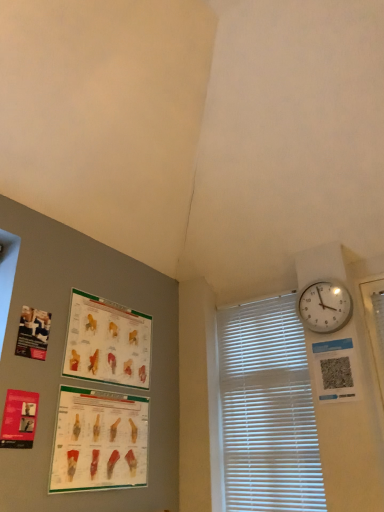
Question: From a real-world perspective, is white plastic blinds at right positioned under matte paper poster at lower left, the first poster page positioned from the bottom, based on gravity?

Choices:
 (A) no
 (B) yes

Answer: (A)

Question: From the image's perspective, would you say white plastic blinds at right is shown under matte paper poster at lower left, marked as the fourth poster page in a top-to-bottom arrangement?

Choices:
 (A) yes
 (B) no

Answer: (B)

Question: Does white plastic blinds at right have a greater height compared to matte paper poster at lower left, marked as the fourth poster page in a top-to-bottom arrangement?

Choices:
 (A) yes
 (B) no

Answer: (A)

Question: Does white plastic blinds at right have a smaller size compared to matte paper poster at lower left, the first poster page positioned from the bottom?

Choices:
 (A) yes
 (B) no

Answer: (B)

Question: Is white plastic blinds at right at the left side of matte paper poster at lower left, the first poster page positioned from the bottom?

Choices:
 (A) no
 (B) yes

Answer: (A)

Question: From the image's perspective, is matte paper poster at upper left, positioned as the third poster page in bottom-to-top order, above or below matte paper poster at left, which is counted as the fourth poster page, starting from the bottom?

Choices:
 (A) above
 (B) below

Answer: (B)

Question: Is matte paper poster at upper left, which is the second poster page from top to bottom, taller or shorter than matte paper poster at left, which is counted as the fourth poster page, starting from the bottom?

Choices:
 (A) tall
 (B) short

Answer: (A)

Question: Looking at their shapes, would you say matte paper poster at upper left, positioned as the third poster page in bottom-to-top order, is wider or thinner than matte paper poster at left, the 1th poster page positioned from the top?

Choices:
 (A) thin
 (B) wide

Answer: (A)

Question: Considering the positions of point (125, 336) and point (41, 340), is point (125, 336) closer or farther from the camera than point (41, 340)?

Choices:
 (A) farther
 (B) closer

Answer: (A)

Question: Considering the positions of matte paper poster at lower left, the first poster page positioned from the bottom, and matte paper poster at left, which is counted as the fourth poster page, starting from the bottom, in the image, is matte paper poster at lower left, the first poster page positioned from the bottom, bigger or smaller than matte paper poster at left, which is counted as the fourth poster page, starting from the bottom,?

Choices:
 (A) small
 (B) big

Answer: (B)

Question: Choose the correct answer: Is matte paper poster at lower left, marked as the fourth poster page in a top-to-bottom arrangement, inside matte paper poster at left, which is counted as the fourth poster page, starting from the bottom, or outside it?

Choices:
 (A) outside
 (B) inside

Answer: (A)

Question: Considering the positions of point (114, 415) and point (31, 320), is point (114, 415) closer or farther from the camera than point (31, 320)?

Choices:
 (A) closer
 (B) farther

Answer: (B)

Question: From the image's perspective, is matte paper poster at lower left, the first poster page positioned from the bottom, located above or below matte paper poster at left, which is counted as the fourth poster page, starting from the bottom?

Choices:
 (A) below
 (B) above

Answer: (A)

Question: Is matte paper poster at left, the 1th poster page positioned from the top, inside the boundaries of matte red poster at lower left, acting as the third poster page starting from the top, or outside?

Choices:
 (A) outside
 (B) inside

Answer: (A)

Question: From the image's perspective, is matte paper poster at left, the 1th poster page positioned from the top, above or below matte red poster at lower left, acting as the third poster page starting from the top?

Choices:
 (A) below
 (B) above

Answer: (B)